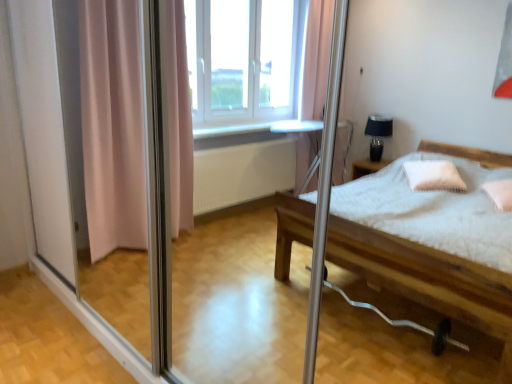
What do you see at coordinates (155, 201) in the screenshot?
I see `transparent glass screen door at center` at bounding box center [155, 201].

The height and width of the screenshot is (384, 512). Find the location of `transparent glass screen door at center`. transparent glass screen door at center is located at coordinates (155, 201).

What is the approximate height of transparent glass screen door at center?

The height of transparent glass screen door at center is 1.79 meters.

This screenshot has height=384, width=512. What are the coordinates of `transparent glass screen door at center` in the screenshot? It's located at (155, 201).